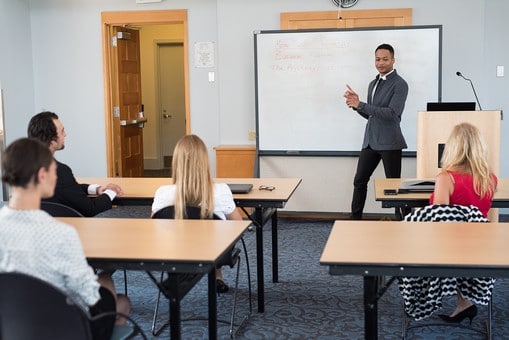
Locate an element on the screen. tables is located at coordinates (383, 183), (277, 183), (214, 230), (377, 239).